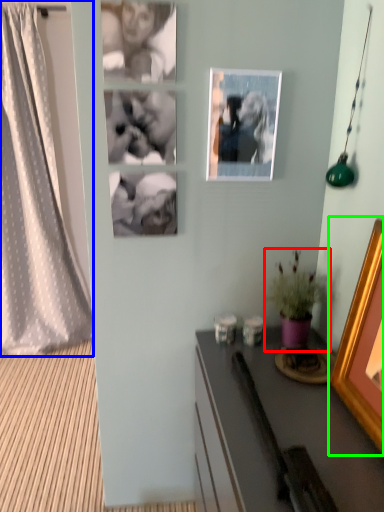
Question: Considering the real-world distances, which object is closest to houseplant (highlighted by a red box)? curtain (highlighted by a blue box) or picture frame (highlighted by a green box).

Choices:
 (A) curtain
 (B) picture frame

Answer: (B)